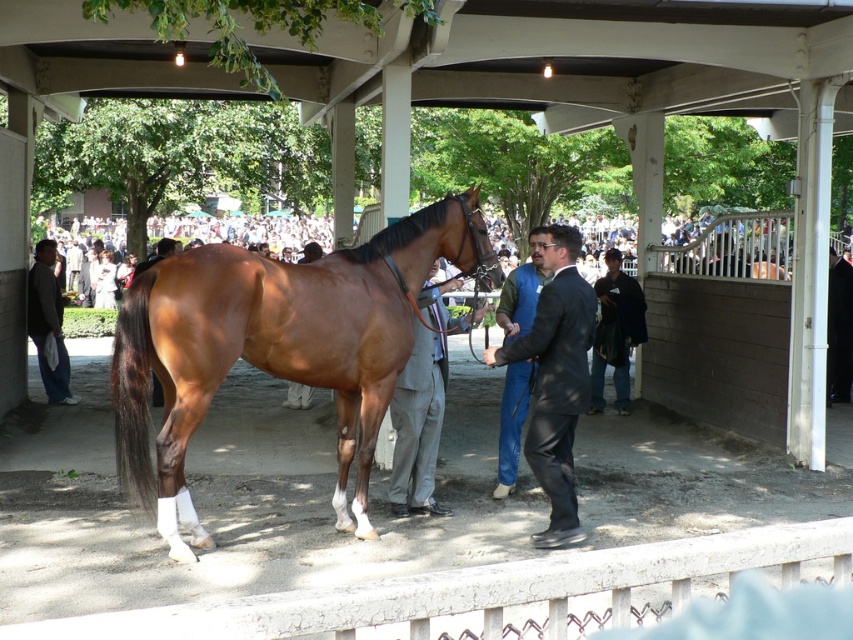
Is point (509, 289) closer to camera compared to point (56, 307)?

Yes, point (509, 289) is in front of point (56, 307).

Based on the photo, does blue jeans at center have a greater width compared to dark gray suit at left?

Incorrect, blue jeans at center's width does not surpass dark gray suit at left's.

I want to click on blue jeans at center, so click(521, 291).

You are a GUI agent. You are given a task and a screenshot of the screen. Output one action in this format:
    pyautogui.click(x=<x>, y=<y>)
    Task: Click on the blue jeans at center
    The image size is (853, 640).
    Given the screenshot: What is the action you would take?
    pyautogui.click(x=521, y=291)

Is brown glossy horse at center positioned behind dark gray suit at left?

No, it is in front of dark gray suit at left.

From the picture: Is brown glossy horse at center thinner than dark gray suit at left?

In fact, brown glossy horse at center might be wider than dark gray suit at left.

Describe the element at coordinates (277, 346) in the screenshot. The width and height of the screenshot is (853, 640). I see `brown glossy horse at center` at that location.

Locate an element on the screen. Image resolution: width=853 pixels, height=640 pixels. brown glossy horse at center is located at coordinates (277, 346).

Consider the image. Which is more to the right, black suit at center or blue jeans at center?

Positioned to the right is black suit at center.

Which is above, black suit at center or blue jeans at center?

black suit at center is higher up.

Is point (532, 422) positioned after point (531, 292)?

No, (532, 422) is in front of (531, 292).

At what (x,y) coordinates should I click in order to perform the action: click on black suit at center. Please return your answer as a coordinate pair (x, y). Looking at the image, I should click on (556, 380).